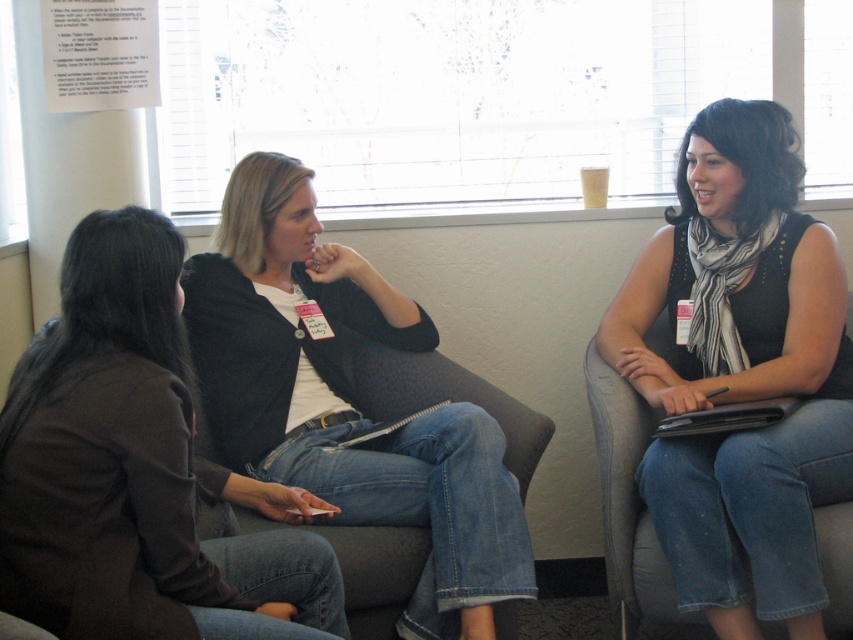
You are an interior designer observing the scene. You need to place a decorative item between the black matte scarf at center and the denim jeans at center. Which object should the item be placed closer to, based on their sizes?

The black matte scarf at center is smaller than the denim jeans at center. Therefore, the decorative item should be placed closer to the black matte scarf at center to account for its smaller size.

You are standing in the room facing the three people. There is a matte black jacket at center and denim jeans at center. Which object is closer to your left side?

The matte black jacket at center is closer to your left side because it is positioned to the left of the denim jeans at center.

You are standing in the room facing the three people. You need to hand a document to the person wearing the black matte scarf at center. Which direction should you move relative to the denim jeans at center to reach them?

The black matte scarf at center is to the right of the denim jeans at center, so you should move to the right side of the denim jeans at center to reach the person wearing the black matte scarf at center.